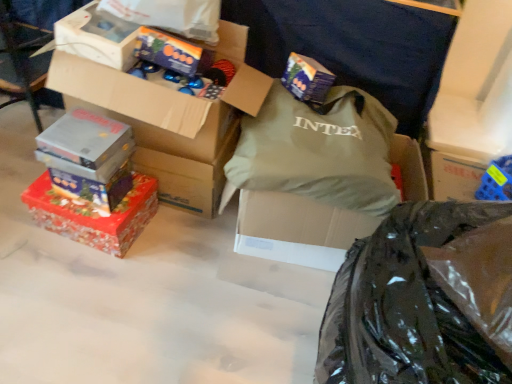
This screenshot has height=384, width=512. What are the coordinates of `vacant area in front of matte green pillow at center, which is the first box in right-to-left order` in the screenshot? It's located at (246, 319).